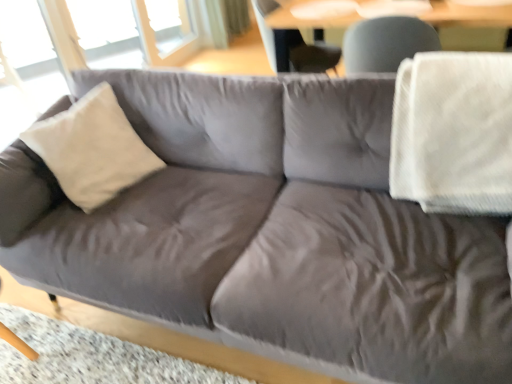
Question: Is point (441, 173) closer or farther from the camera than point (123, 33)?

Choices:
 (A) farther
 (B) closer

Answer: (B)

Question: Is white textured blanket at right spatially inside transparent glass window at upper left, or outside of it?

Choices:
 (A) inside
 (B) outside

Answer: (B)

Question: Considering the real-world distances, which object is farthest from the matte gray swivel chair at upper center?

Choices:
 (A) beige fabric pillow at left
 (B) transparent glass window at upper left
 (C) white textured blanket at right

Answer: (B)

Question: Estimate the real-world distances between objects in this image. Which object is closer to the transparent glass window at upper left?

Choices:
 (A) white textured blanket at right
 (B) beige fabric pillow at left
 (C) matte gray swivel chair at upper center

Answer: (C)